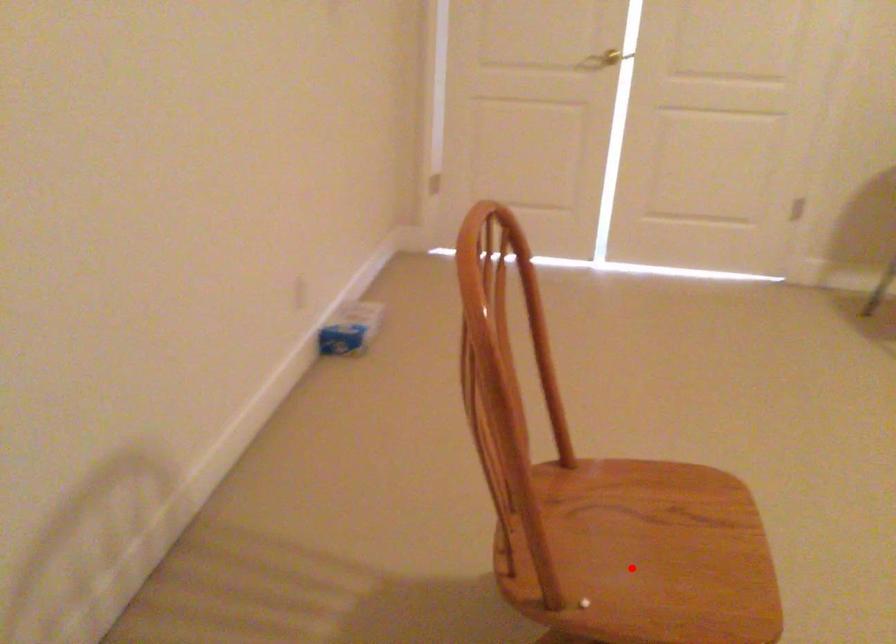
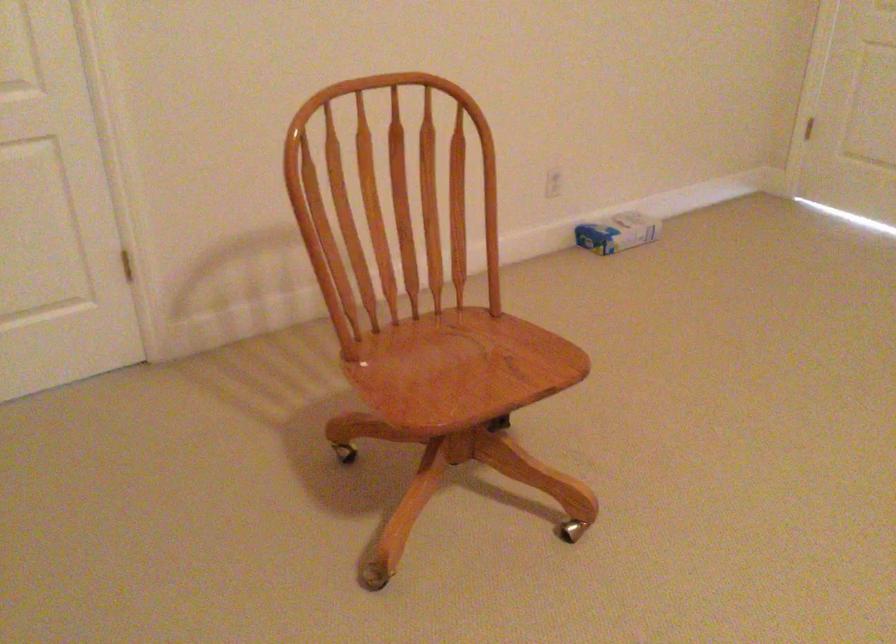
Question: I am providing you with two images of the same scene from different viewpoints. In image1, a red point is highlighted. Considering the same 3D point in image2, which of the following is correct?

Choices:
 (A) It is closer
 (B) It is farther

Answer: (B)